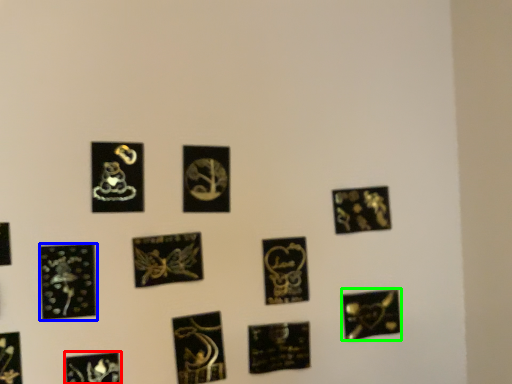
Question: Based on their relative distances, which object is nearer to picture frame (highlighted by a red box)? Choose from picture frame (highlighted by a blue box) and picture frame (highlighted by a green box).

Choices:
 (A) picture frame
 (B) picture frame

Answer: (A)